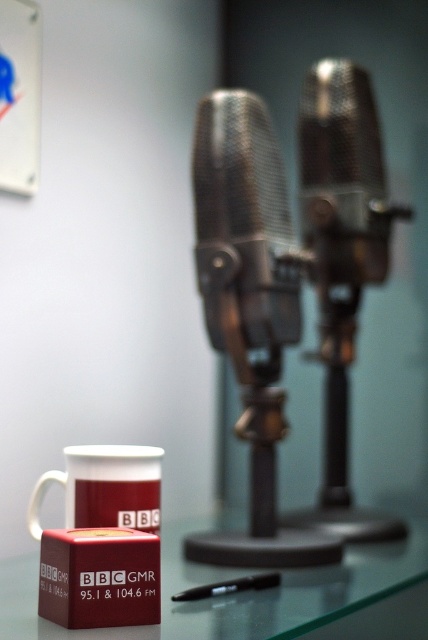
Question: Among these objects, which one is nearest to the camera?

Choices:
 (A) white ceramic mug at lower left
 (B) metallic mesh microphone at center

Answer: (A)

Question: Does metallic mesh microphone at center have a lesser width compared to white ceramic mug at lower left?

Choices:
 (A) no
 (B) yes

Answer: (A)

Question: Is metallic mesh microphone at center wider than white ceramic mug at lower left?

Choices:
 (A) no
 (B) yes

Answer: (B)

Question: Which point is farther to the camera?

Choices:
 (A) white ceramic mug at lower left
 (B) black plastic pen at lower center
 (C) transparent glass table at lower center
 (D) metallic mesh microphone at center

Answer: (D)

Question: Which point is closer to the camera?

Choices:
 (A) (157, 579)
 (B) (104, 460)
 (C) (256, 262)
 (D) (232, 636)

Answer: (D)

Question: Is transparent glass table at lower center further to the viewer compared to black plastic pen at lower center?

Choices:
 (A) yes
 (B) no

Answer: (B)